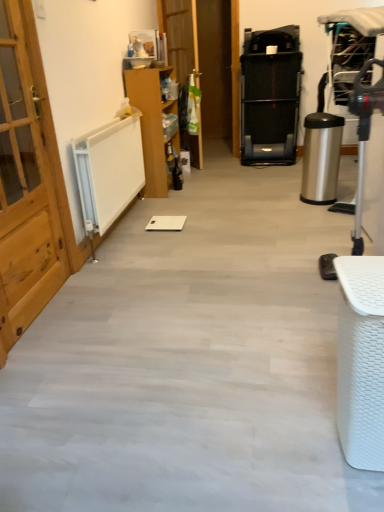
The width and height of the screenshot is (384, 512). What do you see at coordinates (180, 34) in the screenshot?
I see `wooden door at center, the 2th door when ordered from front to back` at bounding box center [180, 34].

What do you see at coordinates (361, 361) in the screenshot? I see `white woven basket at lower right, which is the first furniture in front-to-back order` at bounding box center [361, 361].

I want to click on wooden cabinet at center, arranged as the second furniture when viewed from the right, so click(x=152, y=124).

Visually, is wooden cabinet at center, the first furniture positioned from the left, positioned to the left or to the right of white woven basket at lower right, which is the first furniture in front-to-back order?

Based on their positions, wooden cabinet at center, the first furniture positioned from the left, is located to the left of white woven basket at lower right, which is the first furniture in front-to-back order.

Can you tell me how much wooden cabinet at center, the first furniture positioned from the left, and white woven basket at lower right, which is the 1th furniture in right-to-left order, differ in facing direction?

There is a 178-degree angle between the facing directions of wooden cabinet at center, the first furniture positioned from the left, and white woven basket at lower right, which is the 1th furniture in right-to-left order.

Relative to white woven basket at lower right, the 2th furniture in the top-to-bottom sequence, is wooden cabinet at center, the first furniture positioned from the left, in front or behind?

wooden cabinet at center, the first furniture positioned from the left, is positioned farther from the viewer than white woven basket at lower right, the 2th furniture in the top-to-bottom sequence.

Based on their sizes in the image, would you say wooden cabinet at center, which is the first furniture from back to front, is bigger or smaller than white woven basket at lower right, the 2th furniture viewed from the back?

wooden cabinet at center, which is the first furniture from back to front, is bigger than white woven basket at lower right, the 2th furniture viewed from the back.

From the image's perspective, is wooden door at center, the 1th door positioned from the right, located above or below white woven basket at lower right, the first furniture when ordered from bottom to top?

wooden door at center, the 1th door positioned from the right, is situated higher than white woven basket at lower right, the first furniture when ordered from bottom to top, in the image.

From the image's perspective, starting from the white woven basket at lower right, the first furniture when ordered from bottom to top, which door is the 2nd one above? Please provide its 2D coordinates.

[(180, 34)]

Between wooden door at center, the 1th door positioned from the right, and white woven basket at lower right, which is the 1th furniture in right-to-left order, which one is positioned in front?

white woven basket at lower right, which is the 1th furniture in right-to-left order.

How different are the orientations of white woven basket at lower right, which is counted as the second furniture, starting from the left, and wooden door at center, which appears as the 2th door when ordered from the bottom, in degrees?

The angle between the facing direction of white woven basket at lower right, which is counted as the second furniture, starting from the left, and the facing direction of wooden door at center, which appears as the 2th door when ordered from the bottom, is 144 degrees.

Which object is more forward, white woven basket at lower right, the 2th furniture viewed from the back, or wooden door at center, which is the 1th door from top to bottom?

Positioned in front is white woven basket at lower right, the 2th furniture viewed from the back.

Looking at this image, does white woven basket at lower right, which is the 1th furniture in right-to-left order, have a smaller size compared to wooden door at center, the 2th door when ordered from front to back?

Yes.

Could you tell me if white woven basket at lower right, which is the first furniture in front-to-back order, is facing wooden door at center, the 1th door positioned from the right?

No, white woven basket at lower right, which is the first furniture in front-to-back order, is not turned towards wooden door at center, the 1th door positioned from the right.

The image size is (384, 512). Find the location of `door above the wooden cabinet at center, the first furniture positioned from the left (from the image's perspective)`. door above the wooden cabinet at center, the first furniture positioned from the left (from the image's perspective) is located at coordinates (180, 34).

Between wooden cabinet at center, which is counted as the second furniture, starting from the bottom, and wooden door at center, which is the 1th door from top to bottom, which one appears on the right side from the viewer's perspective?

Positioned to the right is wooden door at center, which is the 1th door from top to bottom.

Which object is thinner, wooden cabinet at center, arranged as the second furniture when viewed from the right, or wooden door at center, which is counted as the 2th door, starting from the left?

With smaller width is wooden door at center, which is counted as the 2th door, starting from the left.

From a real-world perspective, is wooden cabinet at center, which is counted as the second furniture, starting from the bottom, on top of wooden door at center, which is counted as the 1th door, starting from the back?

Actually, wooden cabinet at center, which is counted as the second furniture, starting from the bottom, is physically below wooden door at center, which is counted as the 1th door, starting from the back, in the real world.

Which object is positioned more to the left, white woven basket at lower right, the first furniture when ordered from bottom to top, or wooden cabinet at center, which is counted as the second furniture, starting from the bottom?

wooden cabinet at center, which is counted as the second furniture, starting from the bottom, is more to the left.

From a real-world perspective, is white woven basket at lower right, which is counted as the second furniture, starting from the left, physically below wooden cabinet at center, arranged as the second furniture when viewed from the right?

Yes, from a real-world perspective, white woven basket at lower right, which is counted as the second furniture, starting from the left, is beneath wooden cabinet at center, arranged as the second furniture when viewed from the right.

Locate an element on the screen. furniture directly beneath the wooden cabinet at center, the 2th furniture positioned from the front (from a real-world perspective) is located at coordinates (361, 361).

From the image's perspective, who appears lower, light wood door at left, which is the first door in bottom-to-top order, or wooden cabinet at center, which is the first furniture from back to front?

light wood door at left, which is the first door in bottom-to-top order, from the image's perspective.

Would you say light wood door at left, which is the first door in bottom-to-top order, is inside or outside wooden cabinet at center, which is counted as the first furniture, starting from the top?

light wood door at left, which is the first door in bottom-to-top order, is located beyond the bounds of wooden cabinet at center, which is counted as the first furniture, starting from the top.

Considering the relative sizes of light wood door at left, which is the first door in front-to-back order, and wooden cabinet at center, which is counted as the second furniture, starting from the bottom, in the image provided, is light wood door at left, which is the first door in front-to-back order, taller than wooden cabinet at center, which is counted as the second furniture, starting from the bottom,?

Indeed, light wood door at left, which is the first door in front-to-back order, has a greater height compared to wooden cabinet at center, which is counted as the second furniture, starting from the bottom.

How much distance is there between light wood door at left, the second door viewed from the right, and wooden cabinet at center, which is counted as the first furniture, starting from the top?

light wood door at left, the second door viewed from the right, is 5.27 feet from wooden cabinet at center, which is counted as the first furniture, starting from the top.

Are light wood door at left, the 2th door in the back-to-front sequence, and wooden door at center, the 2th door when ordered from front to back, far apart?

Absolutely, light wood door at left, the 2th door in the back-to-front sequence, is distant from wooden door at center, the 2th door when ordered from front to back.

Between point (9, 343) and point (182, 15), which one is positioned in front?

Point (9, 343)

This screenshot has height=512, width=384. What are the coordinates of `furniture that is below the wooden cabinet at center, the 2th furniture positioned from the front (from the image's perspective)` in the screenshot? It's located at (361, 361).

From a real-world perspective, starting from the wooden door at center, which appears as the 2th door when ordered from the bottom, which furniture is the 2nd one below it? Please provide its 2D coordinates.

[(361, 361)]

Consider the image. Which object lies further to the anchor point wooden cabinet at center, which is counted as the second furniture, starting from the bottom, wooden door at center, which appears as the 2th door when ordered from the bottom, or light wood door at left, which is the first door in bottom-to-top order?

Based on the image, light wood door at left, which is the first door in bottom-to-top order, appears to be further to wooden cabinet at center, which is counted as the second furniture, starting from the bottom.

Estimate the real-world distances between objects in this image. Which object is further from wooden door at center, the 2th door when ordered from front to back, white woven basket at lower right, the first furniture when ordered from bottom to top, or wooden cabinet at center, which is counted as the first furniture, starting from the top?

white woven basket at lower right, the first furniture when ordered from bottom to top, is further to wooden door at center, the 2th door when ordered from front to back.

From the image, which object appears to be nearer to wooden door at center, the 1th door positioned from the right, wooden cabinet at center, the first furniture positioned from the left, or light wood door at left, which is the first door in bottom-to-top order?

wooden cabinet at center, the first furniture positioned from the left, is closer to wooden door at center, the 1th door positioned from the right.

Based on their spatial positions, is white woven basket at lower right, the 2th furniture viewed from the back, or wooden cabinet at center, which is the first furniture from back to front, further from light wood door at left, the second door viewed from the right?

wooden cabinet at center, which is the first furniture from back to front, lies further to light wood door at left, the second door viewed from the right, than the other object.

Estimate the real-world distances between objects in this image. Which object is closer to white woven basket at lower right, the 2th furniture in the top-to-bottom sequence, light wood door at left, the second door viewed from the right, or wooden cabinet at center, arranged as the second furniture when viewed from the right?

Among the two, light wood door at left, the second door viewed from the right, is located nearer to white woven basket at lower right, the 2th furniture in the top-to-bottom sequence.

Which object lies further to the anchor point wooden cabinet at center, arranged as the second furniture when viewed from the right, white woven basket at lower right, which is counted as the second furniture, starting from the left, or light wood door at left, the second door when ordered from top to bottom?

white woven basket at lower right, which is counted as the second furniture, starting from the left.

Consider the image. Considering their positions, is white woven basket at lower right, the 2th furniture viewed from the back, positioned further to light wood door at left, the 2th door in the back-to-front sequence, than wooden door at center, which appears as the 2th door when ordered from the bottom?

wooden door at center, which appears as the 2th door when ordered from the bottom, is positioned further to the anchor light wood door at left, the 2th door in the back-to-front sequence.

Considering their positions, is wooden door at center, which is counted as the 2th door, starting from the left, positioned further to white woven basket at lower right, the 2th furniture viewed from the back, than light wood door at left, which is the first door in front-to-back order?

The object further to white woven basket at lower right, the 2th furniture viewed from the back, is wooden door at center, which is counted as the 2th door, starting from the left.

Find the location of a particular element. The width and height of the screenshot is (384, 512). door positioned between white woven basket at lower right, the first furniture when ordered from bottom to top, and wooden cabinet at center, arranged as the second furniture when viewed from the right, from near to far is located at coordinates (26, 185).

Find the location of a particular element. This screenshot has height=512, width=384. furniture between light wood door at left, the second door viewed from the right, and wooden door at center, which is counted as the 2th door, starting from the left, in the front-back direction is located at coordinates (152, 124).

What are the coordinates of `door located between white woven basket at lower right, which is counted as the second furniture, starting from the left, and wooden door at center, which is the 1th door from top to bottom, in the depth direction` in the screenshot? It's located at (26, 185).

Identify the location of furniture between white woven basket at lower right, which is the 1th furniture in right-to-left order, and wooden door at center, the 2th door when ordered from front to back, from front to back. (152, 124).